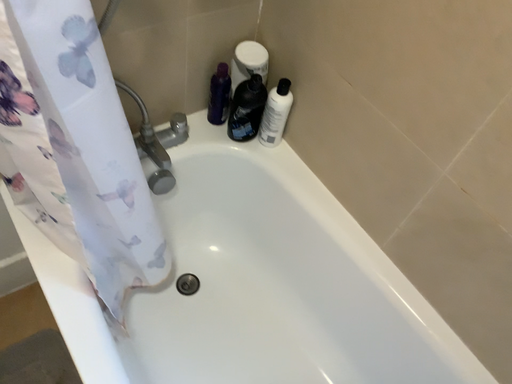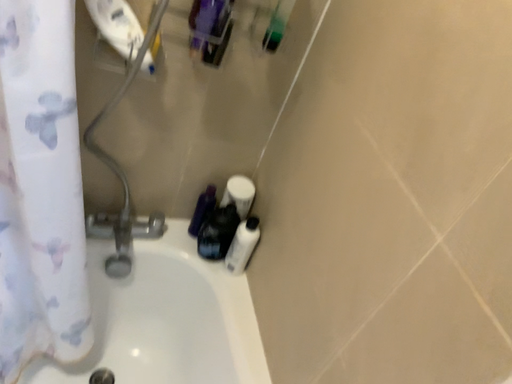
Question: How did the camera likely rotate when shooting the video?

Choices:
 (A) rotated upward
 (B) rotated downward

Answer: (A)